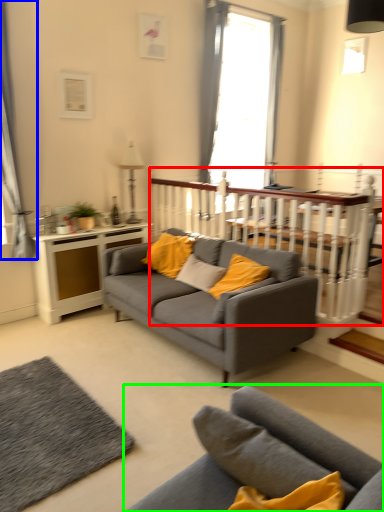
Question: Which object is positioned farthest from balustrade (highlighted by a red box)? Select from curtain (highlighted by a blue box) and studio couch (highlighted by a green box).

Choices:
 (A) curtain
 (B) studio couch

Answer: (B)